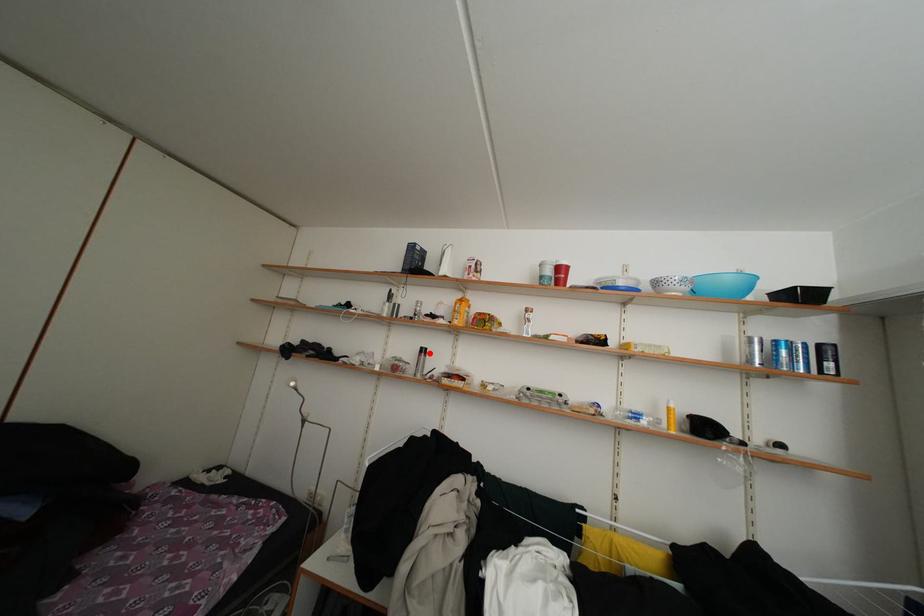
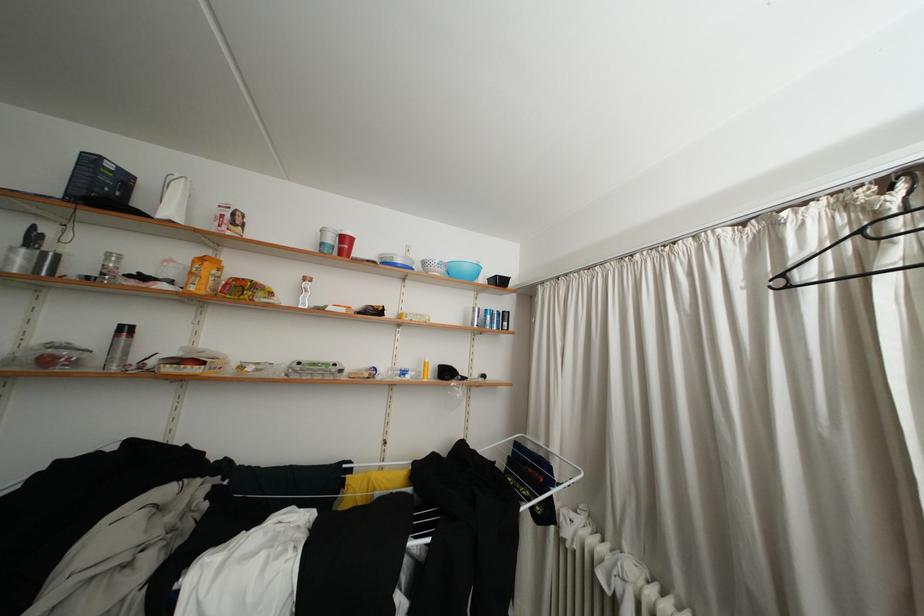
Find the pixel in the second image that matches the highlighted location in the first image.

(129, 331)